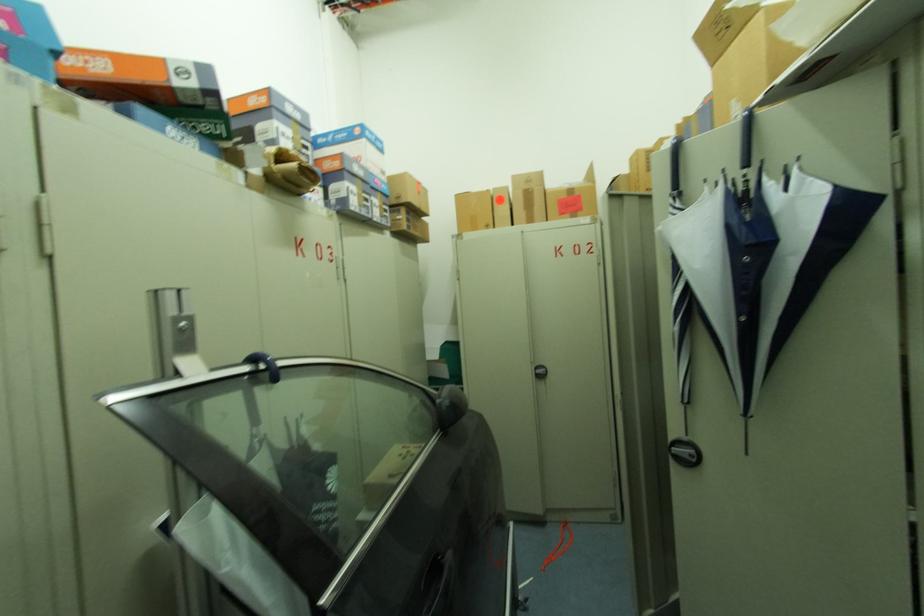
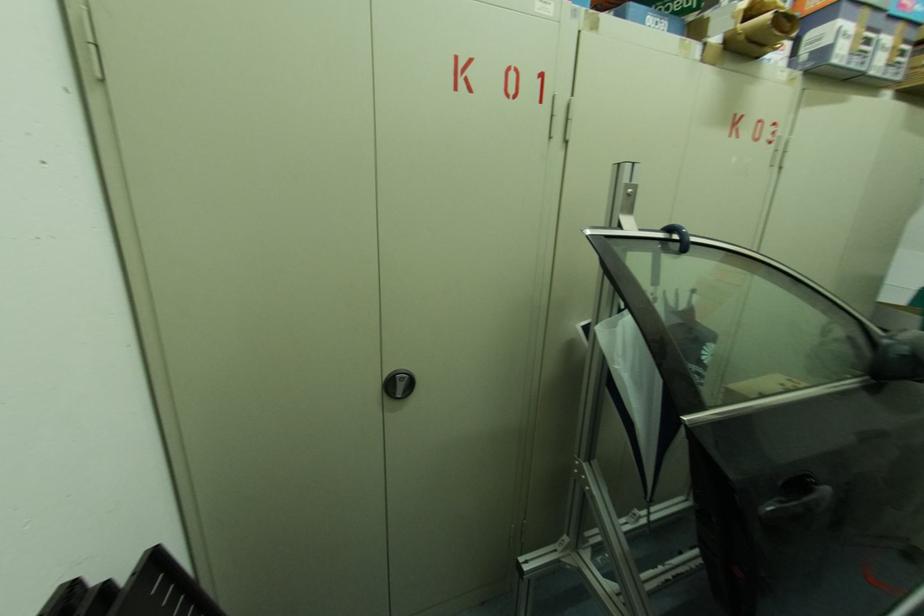
How did the camera likely rotate?

The rotation direction of the camera is left-down.